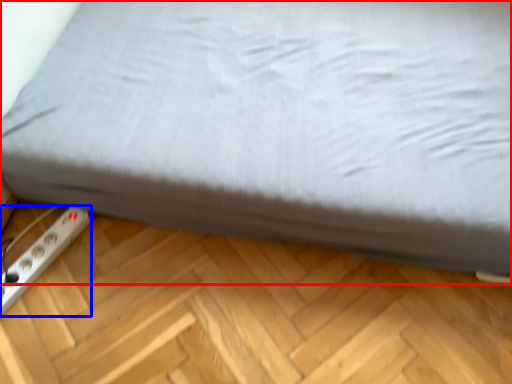
Question: Which of the following is the closest to the observer, bed (highlighted by a red box) or power plugs and sockets (highlighted by a blue box)?

Choices:
 (A) bed
 (B) power plugs and sockets

Answer: (A)